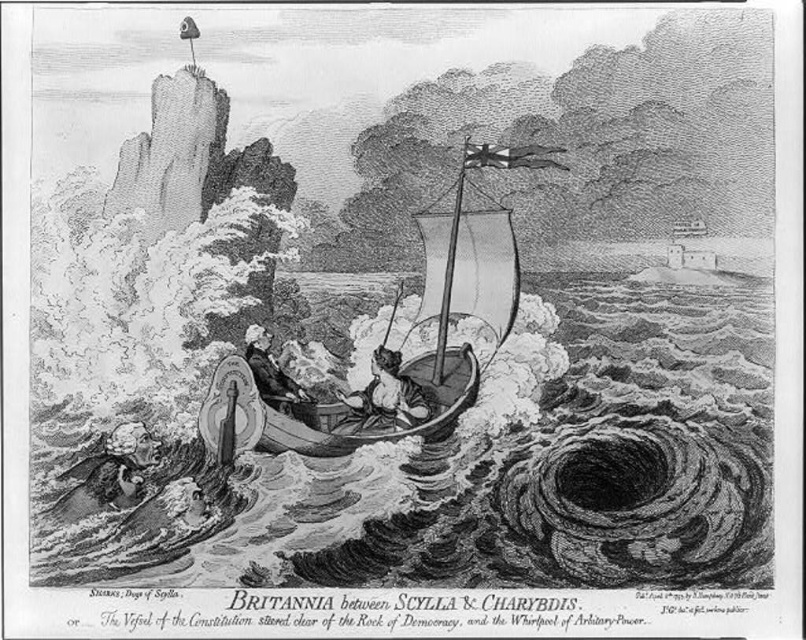
Question: Is wooden sailboat at center in front of smooth leather jacket at center?

Choices:
 (A) yes
 (B) no

Answer: (A)

Question: Does smooth skin woman at center have a smaller size compared to smooth leather jacket at center?

Choices:
 (A) no
 (B) yes

Answer: (A)

Question: Which of the following is the farthest from the observer?

Choices:
 (A) (420, 317)
 (B) (260, 387)

Answer: (A)

Question: Which point appears closest to the camera in this image?

Choices:
 (A) (258, 388)
 (B) (413, 420)
 (C) (496, 298)

Answer: (A)

Question: Which object appears farthest from the camera in this image?

Choices:
 (A) smooth skin woman at center
 (B) wooden sailboat at center

Answer: (A)

Question: Does wooden sailboat at center appear on the left side of smooth skin woman at center?

Choices:
 (A) no
 (B) yes

Answer: (A)